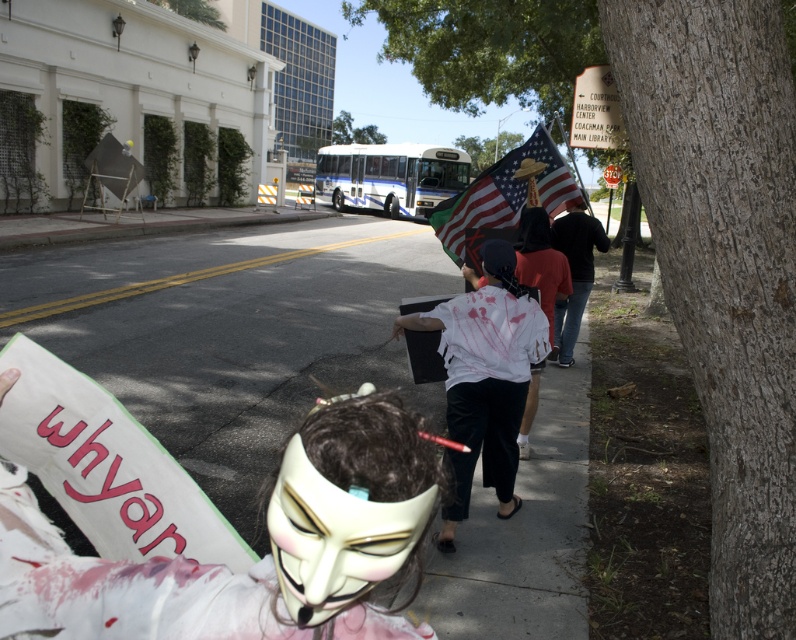
Question: Is concrete sidewalk at center behind white matte shirt at center?

Choices:
 (A) yes
 (B) no

Answer: (B)

Question: Which point is closer to the camera?

Choices:
 (A) white matte shirt at center
 (B) american flag at center

Answer: (A)

Question: Which of these objects is positioned farthest from the white matte shirt at center?

Choices:
 (A) dark blue jeans at center
 (B) white matte mask at center

Answer: (B)

Question: Can you confirm if american flag at center is wider than dark blue jeans at center?

Choices:
 (A) yes
 (B) no

Answer: (A)

Question: Is concrete sidewalk at center to the right of american flag at center from the viewer's perspective?

Choices:
 (A) yes
 (B) no

Answer: (B)

Question: Estimate the real-world distances between objects in this image. Which object is closer to the concrete sidewalk at center?

Choices:
 (A) white matte mask at center
 (B) dark blue jeans at center
 (C) white matte shirt at center

Answer: (C)